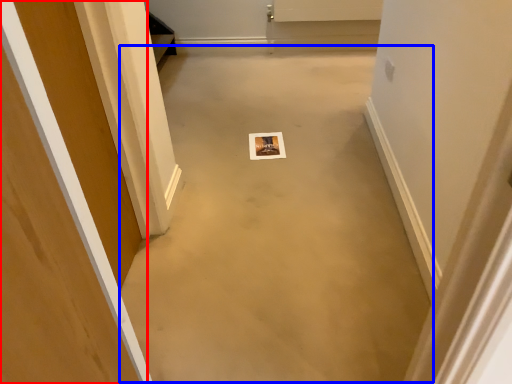
Question: Which of the following is the closest to the observer, door (highlighted by a red box) or concrete (highlighted by a blue box)?

Choices:
 (A) door
 (B) concrete

Answer: (A)